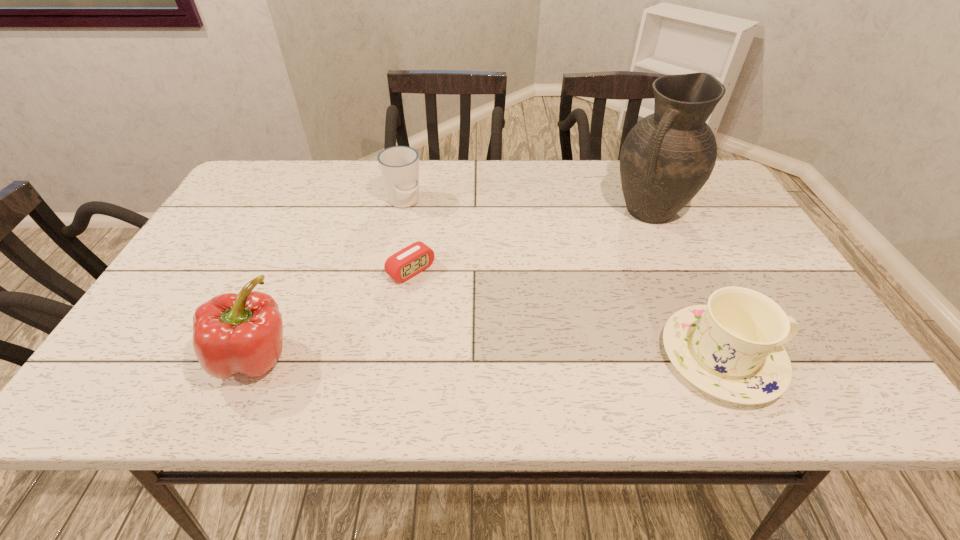
Where is `the closest object to the leftmost object`? The height and width of the screenshot is (540, 960). the closest object to the leftmost object is located at coordinates (415, 258).

This screenshot has height=540, width=960. I want to click on free point that satisfies the following two spatial constraints: 1. on the back side of the pepper; 2. on the right side of the cup, so [322, 201].

Image resolution: width=960 pixels, height=540 pixels. Find the location of `vacant position in the image that satisfies the following two spatial constraints: 1. on the back side of the pitcher; 2. on the left side of the pepper`. vacant position in the image that satisfies the following two spatial constraints: 1. on the back side of the pitcher; 2. on the left side of the pepper is located at coordinates (318, 211).

Where is `free point that satisfies the following two spatial constraints: 1. on the front side of the chinaware; 2. on the handle side of the pitcher`? The image size is (960, 540). free point that satisfies the following two spatial constraints: 1. on the front side of the chinaware; 2. on the handle side of the pitcher is located at coordinates (715, 357).